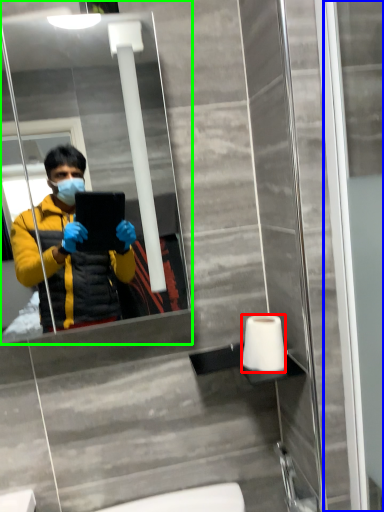
Question: Which object is positioned closest to toilet paper (highlighted by a red box)? Select from screen door (highlighted by a blue box) and mirror (highlighted by a green box).

Choices:
 (A) screen door
 (B) mirror

Answer: (A)